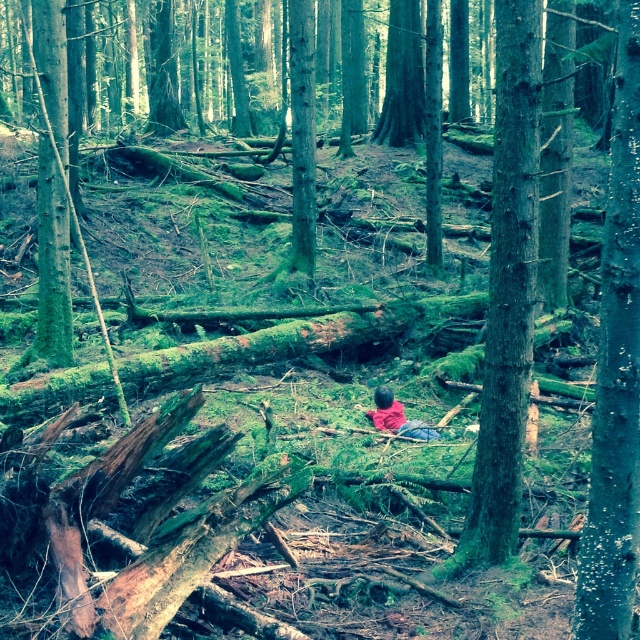
You are a hiker who wants to take a photo of the green mossy tree at left without the green rough bark tree at center blocking the view. How should you adjust your position?

Result: Move to the side so that the green rough bark tree at center is no longer in front of the green mossy tree at left.

You are planning to take a photo of both the green rough bark tree at center and the green mossy tree at left. Since you want both trees to be fully visible in the frame, which tree should you position closer to the camera to ensure the shorter one isn not cropped?

The green rough bark tree at center is shorter than the green mossy tree at left, so you should position the green rough bark tree at center closer to the camera to ensure it is fully visible without being cropped.

From the picture: You are planning to sit on the green mossy log at center while observing the green mossy tree at left. Considering their sizes, which object would you need to move closer to get a better view?

The green mossy log at center occupies less space than the green mossy tree at left, so you should move closer to the green mossy log at center to get a better view.